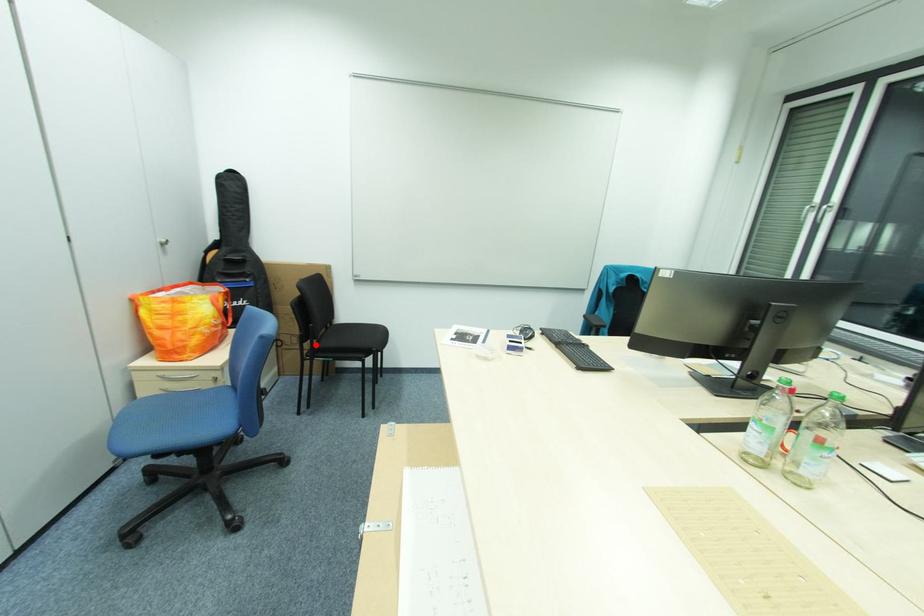
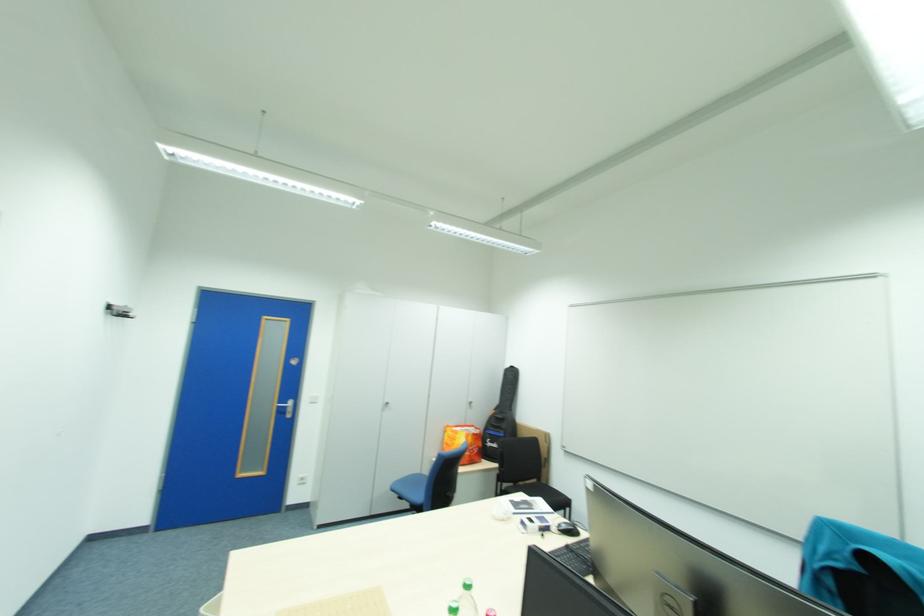
Where in the second image is the point corresponding to the highlighted location from the first image?

(508, 484)